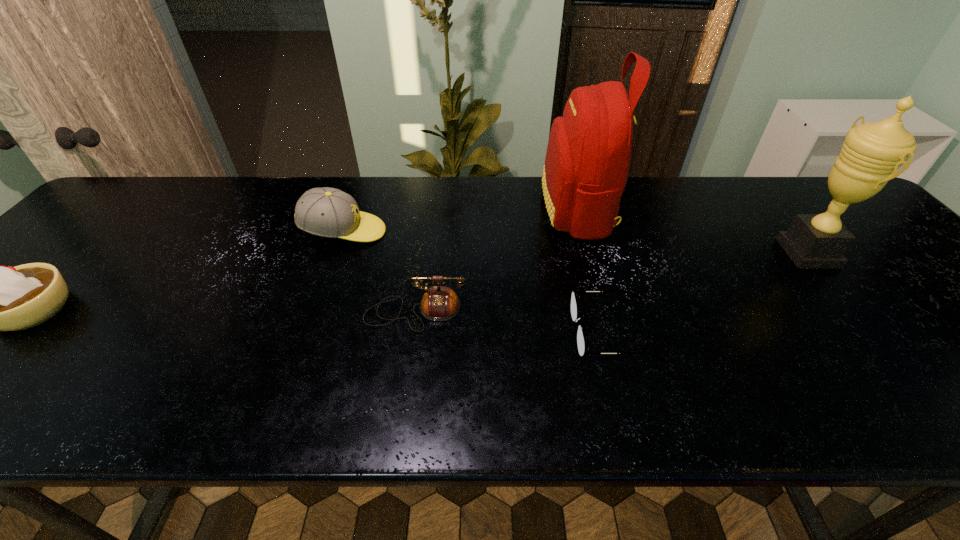
Image resolution: width=960 pixels, height=540 pixels. I want to click on free space located 0.320m at the front of the rightmost object with handles, so click(659, 253).

What are the coordinates of `free space located 0.230m on the front-facing side of the baseball cap` in the screenshot? It's located at (471, 232).

Find the location of a particular element. free space located 0.160m on the rotary dial of the telephone is located at coordinates (403, 401).

At what (x,y) coordinates should I click in order to perform the action: click on free space located 0.270m on the lenses of the spectacles. Please return your answer as a coordinate pair (x, y). Looking at the image, I should click on (446, 333).

Locate an element on the screen. The height and width of the screenshot is (540, 960). blank space located 0.130m on the lenses of the spectacles is located at coordinates (513, 333).

At what (x,y) coordinates should I click in order to perform the action: click on free region located on the lenses of the spectacles. Please return your answer as a coordinate pair (x, y). Looking at the image, I should click on (536, 333).

In order to click on backpack that is positioned at the far edge in this screenshot , I will do `click(587, 161)`.

The width and height of the screenshot is (960, 540). I want to click on baseball cap at the far edge, so click(x=327, y=212).

The height and width of the screenshot is (540, 960). What are the coordinates of `vacant space at the far edge of the desktop` in the screenshot? It's located at (716, 193).

Locate an element on the screen. This screenshot has width=960, height=540. free space at the near edge of the desktop is located at coordinates (279, 401).